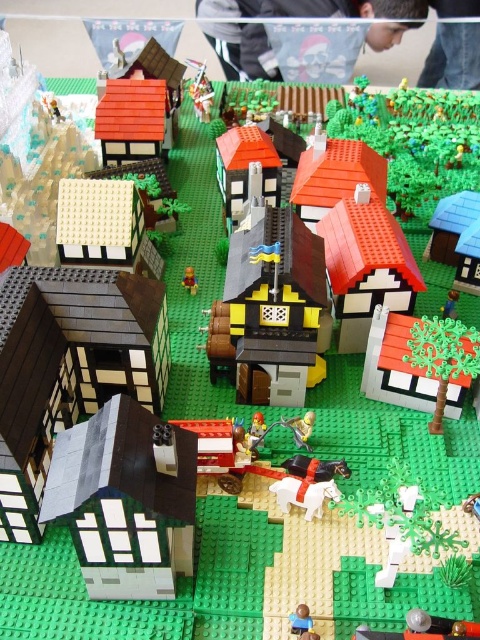
Question: Is matte gray house at lower left further to the viewer compared to smooth yellow minifigure at center?

Choices:
 (A) no
 (B) yes

Answer: (A)

Question: Which object is farther from the camera taking this photo?

Choices:
 (A) smooth yellow minifigure at center
 (B) matte gray house at lower left

Answer: (A)

Question: Is matte gray house at lower left bigger than smooth yellow minifigure at center?

Choices:
 (A) no
 (B) yes

Answer: (B)

Question: Which point appears closest to the camera in this image?

Choices:
 (A) (190, 292)
 (B) (119, 538)

Answer: (B)

Question: Which point is closer to the camera taking this photo?

Choices:
 (A) (196, 285)
 (B) (98, 512)

Answer: (B)

Question: Is matte gray house at lower left positioned before smooth yellow minifigure at center?

Choices:
 (A) no
 (B) yes

Answer: (B)